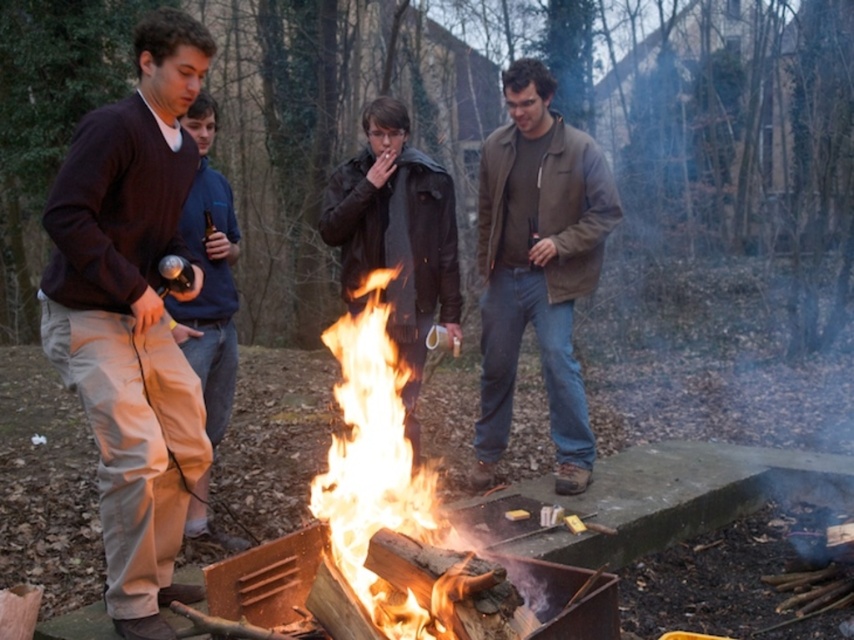
Question: Does leather jacket at center appear on the right side of matte brown pants at left?

Choices:
 (A) no
 (B) yes

Answer: (B)

Question: Where is leather jacket at center located in relation to matte brown pants at left in the image?

Choices:
 (A) left
 (B) right

Answer: (B)

Question: Which object appears closest to the camera in this image?

Choices:
 (A) brown leather jacket at center
 (B) matte brown pants at left
 (C) flamewoodenfire at center
 (D) matte brown sweater at left

Answer: (C)

Question: Is matte brown sweater at left positioned before leather jacket at center?

Choices:
 (A) yes
 (B) no

Answer: (A)

Question: Among these objects, which one is nearest to the camera?

Choices:
 (A) matte brown pants at left
 (B) brown leather jacket at center
 (C) flamewoodenfire at center
 (D) leather jacket at center

Answer: (C)

Question: Which point is closer to the camera?

Choices:
 (A) (366, 120)
 (B) (203, 125)
 (C) (358, 573)
 (D) (487, 209)

Answer: (C)